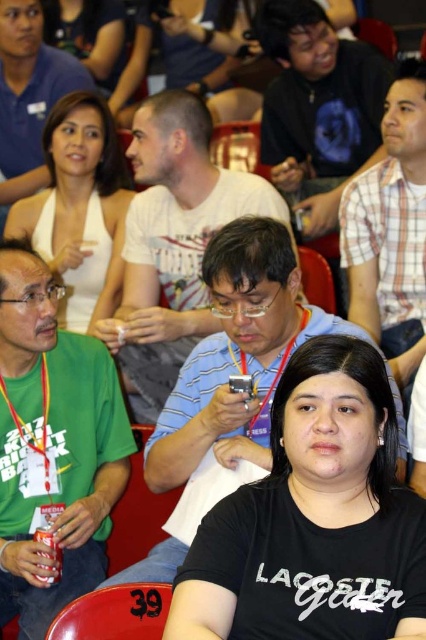
Question: Does green matte shirt at center appear over matte white tank top at upper center?

Choices:
 (A) yes
 (B) no

Answer: (B)

Question: Among these objects, which one is farthest from the camera?

Choices:
 (A) matte white shirt at upper center
 (B) striped cotton shirt at center
 (C) dark blue t-shirt at center
 (D) matte white tank top at upper center

Answer: (A)

Question: Does striped cotton shirt at center have a larger size compared to matte white tank top at upper center?

Choices:
 (A) no
 (B) yes

Answer: (B)

Question: Is white plaid shirt at center positioned at the back of white matte halter top at upper left?

Choices:
 (A) no
 (B) yes

Answer: (A)

Question: Which of these objects is positioned closest to the black cotton shirt at lower center?

Choices:
 (A) striped cotton shirt at center
 (B) matte white shirt at upper left
 (C) matte white shirt at center
 (D) green matte shirt at center

Answer: (A)

Question: Which is nearer to the striped cotton shirt at center?

Choices:
 (A) black cotton shirt at lower center
 (B) matte silver can at lower left

Answer: (A)